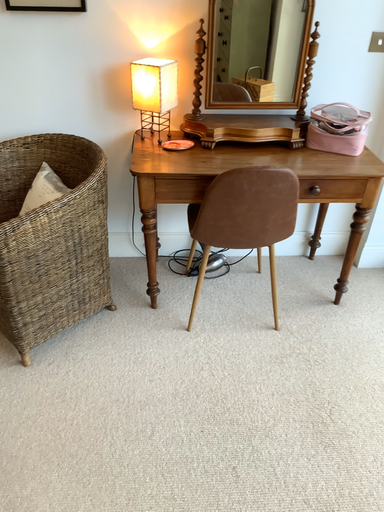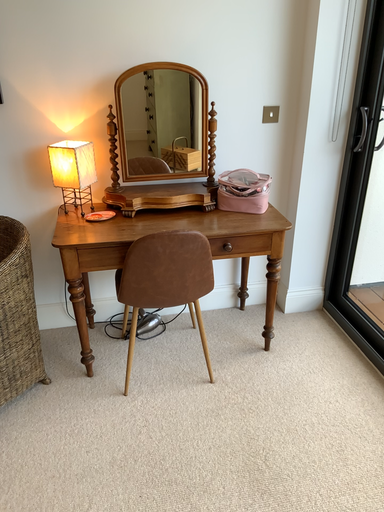
Question: How did the camera likely rotate when shooting the video?

Choices:
 (A) rotated downward
 (B) rotated upward

Answer: (B)